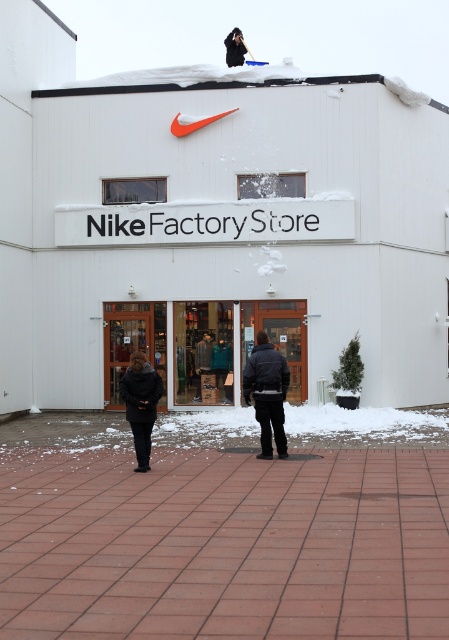
Find the location of a particular element. Image resolution: width=449 pixels, height=640 pixels. dark blue fabric jacket at center is located at coordinates (267, 392).

Is point (272, 364) positioned before point (136, 355)?

No, (272, 364) is further to viewer.

Find the location of a particular element. dark blue fabric jacket at center is located at coordinates (267, 392).

Which is above, dark gray fabric coat at center or dark blue fabric jacket at center?

dark gray fabric coat at center is above.

This screenshot has height=640, width=449. Describe the element at coordinates (268, 392) in the screenshot. I see `dark gray fabric coat at center` at that location.

Where is `dark gray fabric coat at center`? This screenshot has width=449, height=640. dark gray fabric coat at center is located at coordinates (268, 392).

Which is in front, point (322, 192) or point (211, 385)?

Point (322, 192) is in front.

Does white matte nike factory store at center appear over matte glass storefront at center?

Yes, white matte nike factory store at center is above matte glass storefront at center.

Who is more distant from viewer, (309, 120) or (109, 328)?

The point (109, 328) is behind.

At what (x,y) coordinates should I click in order to perform the action: click on white matte nike factory store at center. Please return your answer as a coordinate pair (x, y). This screenshot has width=449, height=640. Looking at the image, I should click on (214, 224).